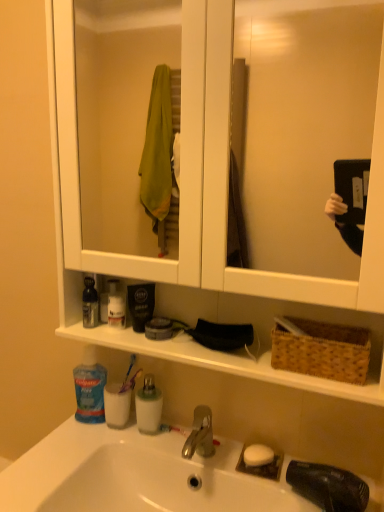
Identify the location of free space in front of white matte soap at center. (266, 490).